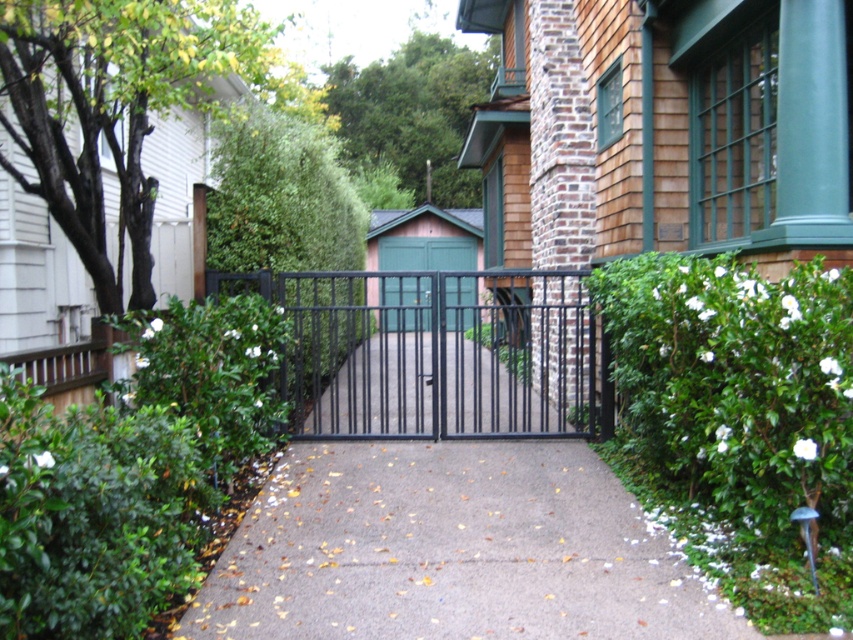
Can you confirm if green leafy hedge at right is positioned to the left of green leafy hedge at center?

Incorrect, green leafy hedge at right is not on the left side of green leafy hedge at center.

Which is below, green leafy hedge at right or green leafy hedge at center?

green leafy hedge at right

Is point (637, 296) less distant than point (358, 284)?

Yes, point (637, 296) is closer to viewer.

You are a GUI agent. You are given a task and a screenshot of the screen. Output one action in this format:
    pyautogui.click(x=<x>, y=<y>)
    Task: Click on the green leafy hedge at right
    This screenshot has height=640, width=853.
    Given the screenshot: What is the action you would take?
    pyautogui.click(x=735, y=387)

Between point (766, 294) and point (457, 324), which one is positioned in front?

Point (766, 294) is more forward.

Does green leafy hedge at right have a greater height compared to green matte door at center?

No, green leafy hedge at right is not taller than green matte door at center.

Locate an element on the screen. The height and width of the screenshot is (640, 853). green leafy hedge at right is located at coordinates (735, 387).

Who is more distant from viewer, (346,333) or (276,180)?

The point (346,333) is behind.

Between black metal gate at center and green leafy hedge at center, which one appears on the right side from the viewer's perspective?

From the viewer's perspective, black metal gate at center appears more on the right side.

Describe the element at coordinates (434, 353) in the screenshot. I see `black metal gate at center` at that location.

Locate an element on the screen. black metal gate at center is located at coordinates (434, 353).